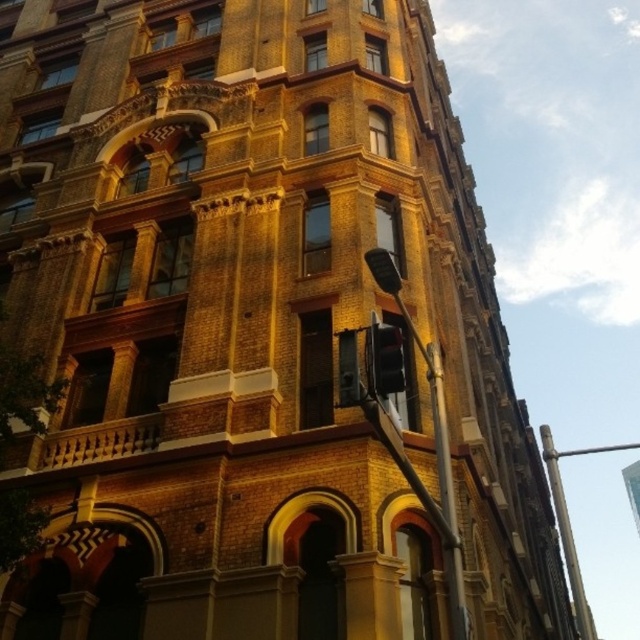
You are standing at the entrance of the tall, ornate building constructed from reddish brown bricks. You want to find the metallic pole at center. Based on its 2D coordinates, where should you look relative to the building?

The metallic pole at center is located at the coordinates 0.689 on the x axis and 0.680 on the y axis, so you should look towards the center of the building slightly to the right and down from the top.

You are a pedestrian standing at the sidewalk in front of the building. You notice a metallic pole at center and a black glass traffic light at center. Which object is closer to you?

The metallic pole at center is closer to you because the black glass traffic light at center is behind it.

You are a pedestrian standing at the entrance of the building. You see a metallic pole at center and a black glass traffic light at center. Which object is positioned to the right when facing the building?

The metallic pole at center is to the right of the black glass traffic light at center when facing the building.